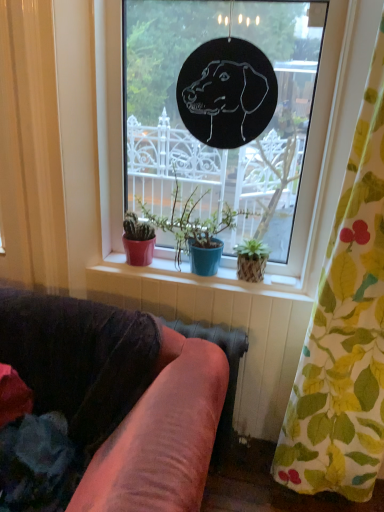
Question: Can you confirm if black paper dog at center is positioned to the left of matte red pot at center?

Choices:
 (A) no
 (B) yes

Answer: (A)

Question: Considering the relative sizes of black paper dog at center and matte red pot at center in the image provided, is black paper dog at center bigger than matte red pot at center?

Choices:
 (A) yes
 (B) no

Answer: (A)

Question: Is black paper dog at center to the right of matte red pot at center from the viewer's perspective?

Choices:
 (A) no
 (B) yes

Answer: (B)

Question: Is black paper dog at center not close to matte red pot at center?

Choices:
 (A) yes
 (B) no

Answer: (B)

Question: Is black paper dog at center smaller than matte red pot at center?

Choices:
 (A) no
 (B) yes

Answer: (A)

Question: From the image's perspective, would you say black paper dog at center is positioned over matte red pot at center?

Choices:
 (A) no
 (B) yes

Answer: (B)

Question: From a real-world perspective, does matte red pot at center stand above black paper dog at center?

Choices:
 (A) yes
 (B) no

Answer: (B)

Question: Can you confirm if matte red pot at center is positioned to the right of black paper dog at center?

Choices:
 (A) yes
 (B) no

Answer: (B)

Question: Is matte red pot at center far from black paper dog at center?

Choices:
 (A) no
 (B) yes

Answer: (A)

Question: Is matte red pot at center behind black paper dog at center?

Choices:
 (A) no
 (B) yes

Answer: (B)

Question: Does matte red pot at center have a lesser height compared to black paper dog at center?

Choices:
 (A) yes
 (B) no

Answer: (A)

Question: From the image's perspective, is matte red pot at center beneath black paper dog at center?

Choices:
 (A) no
 (B) yes

Answer: (B)

Question: From a real-world perspective, is matte ceramic pots at center located beneath floral fabric curtain at right?

Choices:
 (A) no
 (B) yes

Answer: (B)